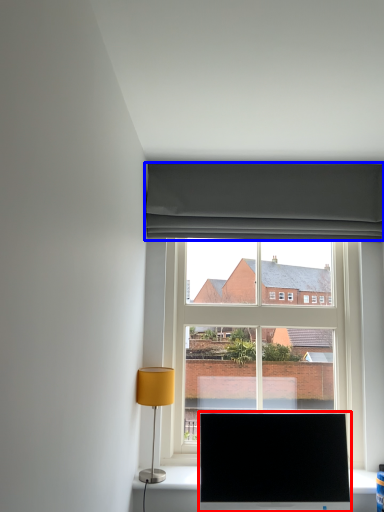
Question: Among these objects, which one is nearest to the camera, television (highlighted by a red box) or curtain (highlighted by a blue box)?

Choices:
 (A) television
 (B) curtain

Answer: (A)